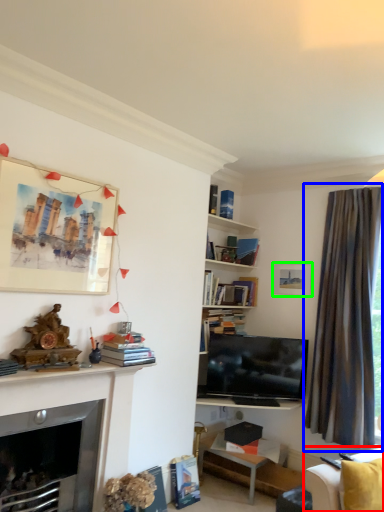
Question: Based on their relative distances, which object is farther from studio couch (highlighted by a red box)? Choose from curtain (highlighted by a blue box) and picture frame (highlighted by a green box).

Choices:
 (A) curtain
 (B) picture frame

Answer: (B)